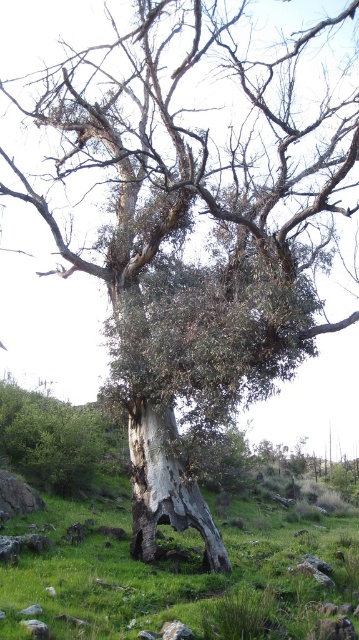
Question: Is green grass at center bigger than gray rough bark tree trunk at center?

Choices:
 (A) no
 (B) yes

Answer: (B)

Question: In this image, where is green grass at center located relative to gray rough bark tree trunk at center?

Choices:
 (A) right
 (B) left

Answer: (A)

Question: Which point is farther to the camera?

Choices:
 (A) (87, 572)
 (B) (193, 524)

Answer: (B)

Question: Among these points, which one is nearest to the camera?

Choices:
 (A) (16, 532)
 (B) (162, 458)

Answer: (B)

Question: Can you confirm if green grass at center is positioned above gray rough bark tree trunk at center?

Choices:
 (A) yes
 (B) no

Answer: (B)